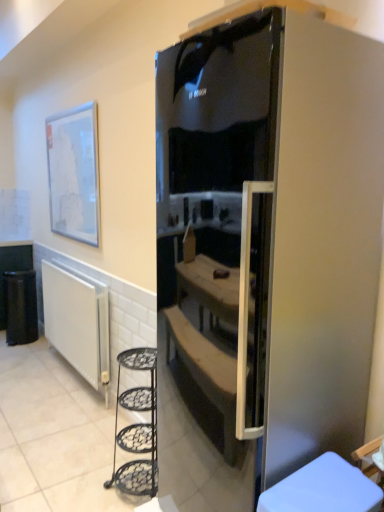
Question: Can you see white ribbed radiator at lower left touching satin black fridge at center?

Choices:
 (A) yes
 (B) no

Answer: (B)

Question: Does white ribbed radiator at lower left have a larger size compared to satin black fridge at center?

Choices:
 (A) no
 (B) yes

Answer: (A)

Question: Does white ribbed radiator at lower left have a greater height compared to satin black fridge at center?

Choices:
 (A) yes
 (B) no

Answer: (B)

Question: Could you tell me if white ribbed radiator at lower left is turned towards satin black fridge at center?

Choices:
 (A) no
 (B) yes

Answer: (A)

Question: Is white ribbed radiator at lower left in front of satin black fridge at center?

Choices:
 (A) no
 (B) yes

Answer: (A)

Question: Does point 49,192 appear closer or farther from the camera than point 329,42?

Choices:
 (A) closer
 (B) farther

Answer: (B)

Question: Based on their sizes in the image, would you say matte white picture frame at upper left is bigger or smaller than satin black fridge at center?

Choices:
 (A) small
 (B) big

Answer: (A)

Question: Is matte white picture frame at upper left spatially inside satin black fridge at center, or outside of it?

Choices:
 (A) inside
 (B) outside

Answer: (B)

Question: From a real-world perspective, relative to satin black fridge at center, is matte white picture frame at upper left vertically above or below?

Choices:
 (A) below
 (B) above

Answer: (B)

Question: Is satin black fridge at center in front of or behind matte white picture frame at upper left in the image?

Choices:
 (A) behind
 (B) front

Answer: (B)

Question: Looking at the image, does satin black fridge at center seem bigger or smaller compared to matte white picture frame at upper left?

Choices:
 (A) small
 (B) big

Answer: (B)

Question: Would you say satin black fridge at center is inside or outside matte white picture frame at upper left?

Choices:
 (A) inside
 (B) outside

Answer: (B)

Question: From the image's perspective, relative to matte white picture frame at upper left, is satin black fridge at center above or below?

Choices:
 (A) above
 (B) below

Answer: (B)

Question: Considering the relative positions of matte white picture frame at upper left and white ribbed radiator at lower left in the image provided, is matte white picture frame at upper left to the left or to the right of white ribbed radiator at lower left?

Choices:
 (A) left
 (B) right

Answer: (B)

Question: Choose the correct answer: Is matte white picture frame at upper left inside white ribbed radiator at lower left or outside it?

Choices:
 (A) inside
 (B) outside

Answer: (B)